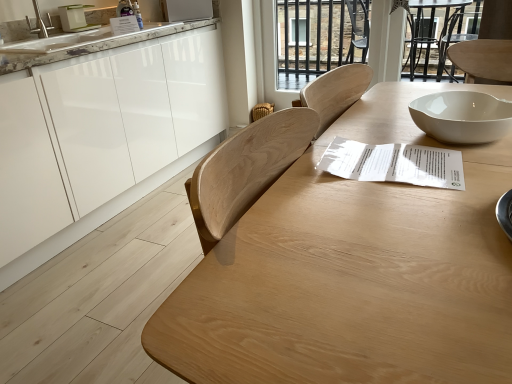
Identify the location of vacant space behind white paper at center. (370, 130).